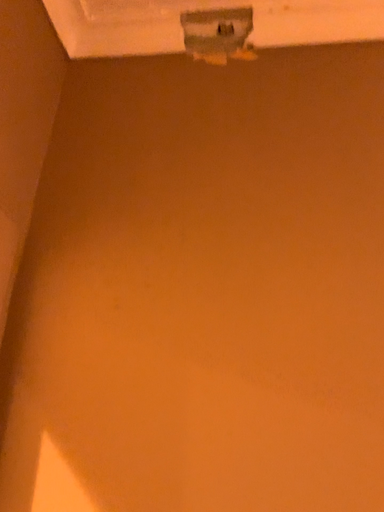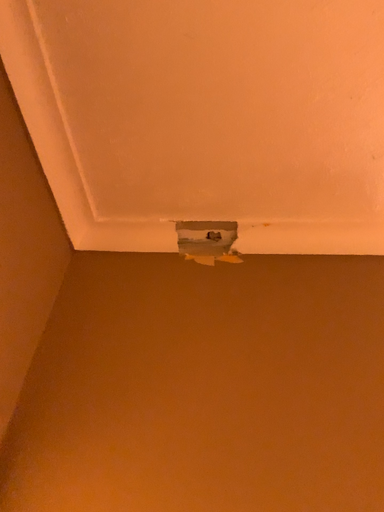
Question: How did the camera likely rotate when shooting the video?

Choices:
 (A) rotated upward
 (B) rotated downward

Answer: (A)